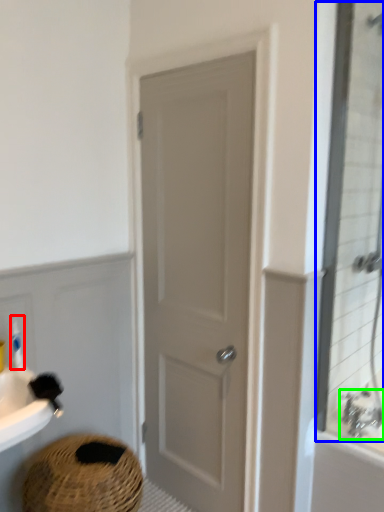
Question: Estimate the real-world distances between objects in this image. Which object is farther from toiletry (highlighted by a red box), mirror (highlighted by a blue box) or tap (highlighted by a green box)?

Choices:
 (A) mirror
 (B) tap

Answer: (A)